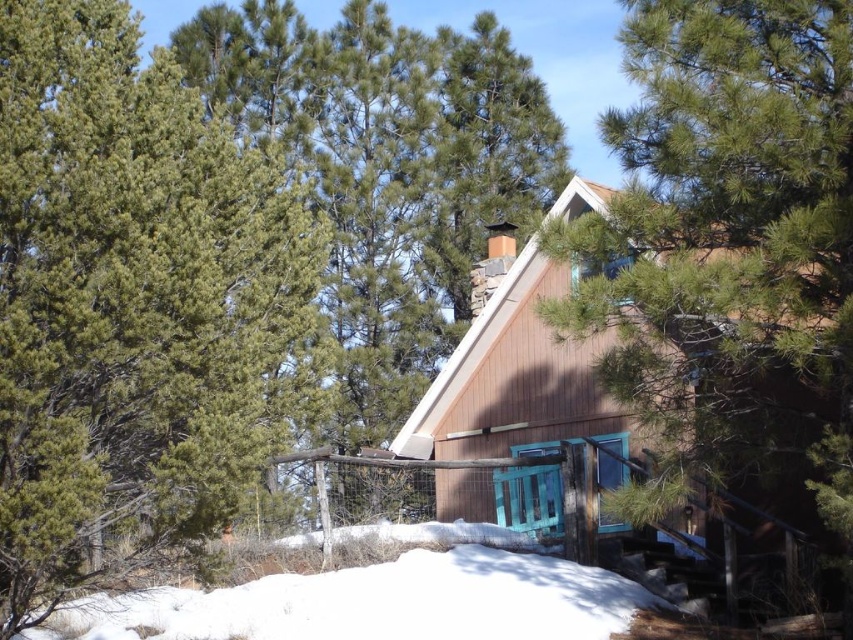
You are planning to build a small shed in the area near the green pine tree at center and the white powdery snow at lower center. Considering their sizes, which object would allow more space for the shed to be constructed?

The white powdery snow at lower center has a greater width than the green pine tree at center, so it would provide more space for constructing the shed.

You are standing in front of the cabin and want to take a photo. There are two points marked in the scene, point (129, 390) and point (489, 333). Which point will appear closer to the camera in your photo?

Point (129, 390) is closer to the camera than point (489, 333), so it will appear closer in the photo.

You are standing in front of the wooden cabin at center and looking towards the green pine tree at center. Which object is closer to you?

The green pine tree at center is closer to you because it is positioned under the wooden cabin at center, meaning it is in front of the cabin.